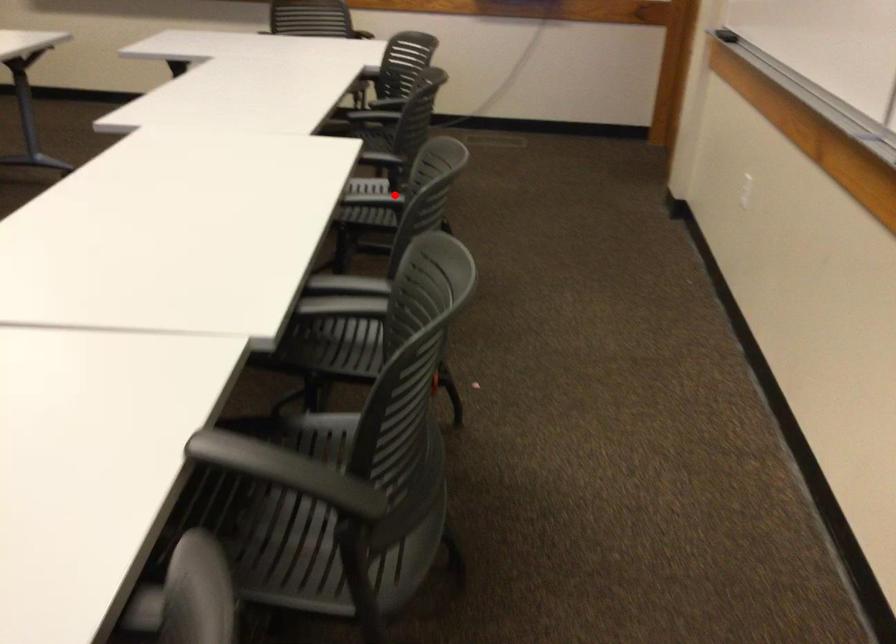
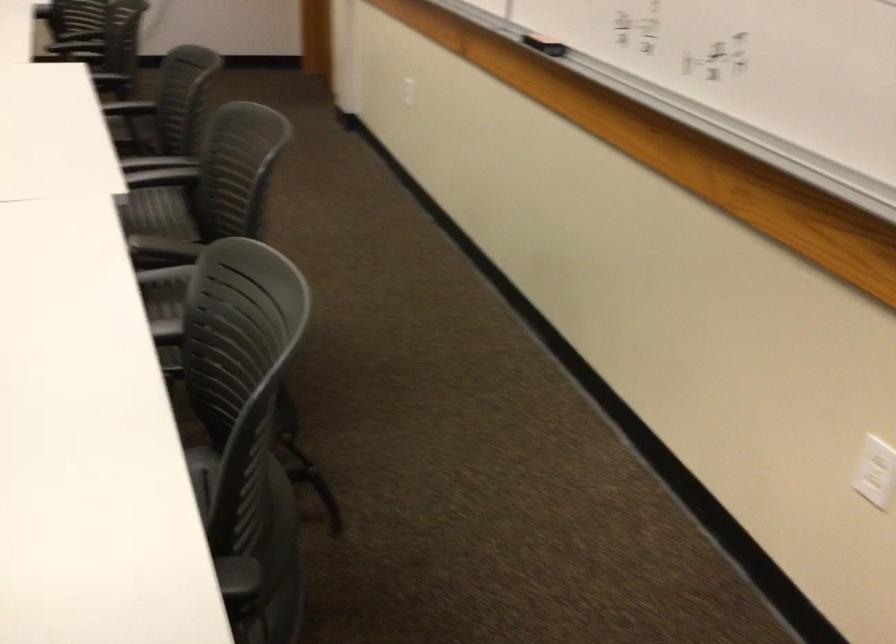
Question: I am providing you with two images of the same scene from different viewpoints. A red point is marked on the first image. Can you still see the location of the red point in image 2?

Choices:
 (A) Yes
 (B) No

Answer: (B)